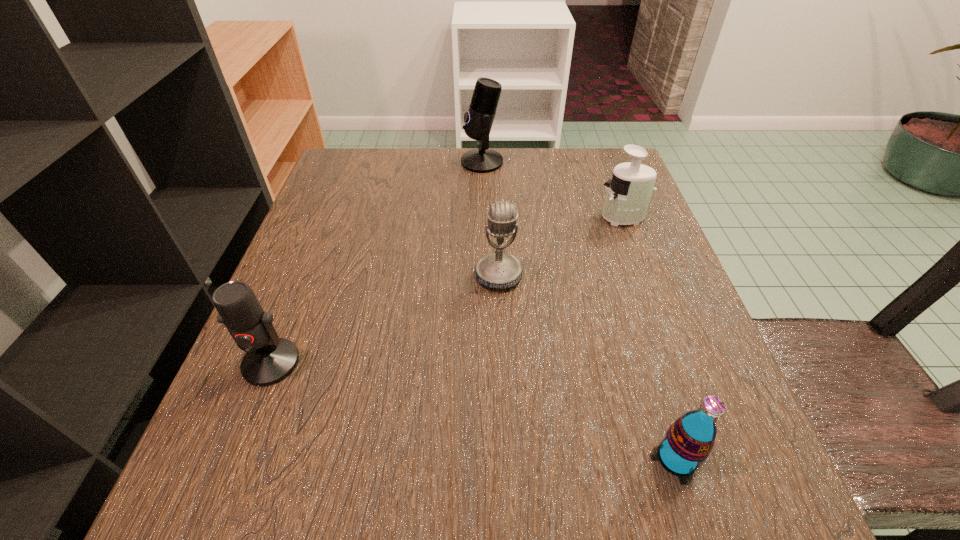
Find the location of a particular element. The width and height of the screenshot is (960, 540). vacant area situated on the stand of the farthest microphone is located at coordinates 437,161.

The width and height of the screenshot is (960, 540). I want to click on vacant area situated 0.150m on the front-facing side of the third farthest object, so click(x=502, y=364).

Locate an element on the screen. This screenshot has width=960, height=540. vacant space located on the left of the fourth nearest object is located at coordinates point(463,217).

The image size is (960, 540). Identify the location of blank area located 0.080m on the left of the nearest object. (589, 458).

Locate an element on the screen. This screenshot has height=540, width=960. object that is at the far edge is located at coordinates (479, 119).

What are the coordinates of `object at the near edge` in the screenshot? It's located at (689, 440).

Where is `object present at the left edge`? object present at the left edge is located at coordinates (269, 359).

Identify the location of juicer at the right edge. The height and width of the screenshot is (540, 960). (629, 192).

This screenshot has width=960, height=540. I want to click on soda at the right edge, so click(689, 440).

The height and width of the screenshot is (540, 960). Identify the location of object positioned at the near right corner. [689, 440].